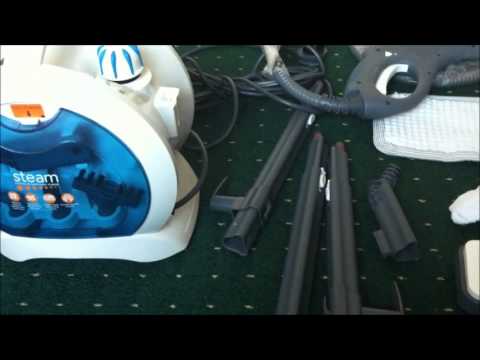
The height and width of the screenshot is (360, 480). In order to click on steam cleaner tool cover in this screenshot , I will do pos(112,177).